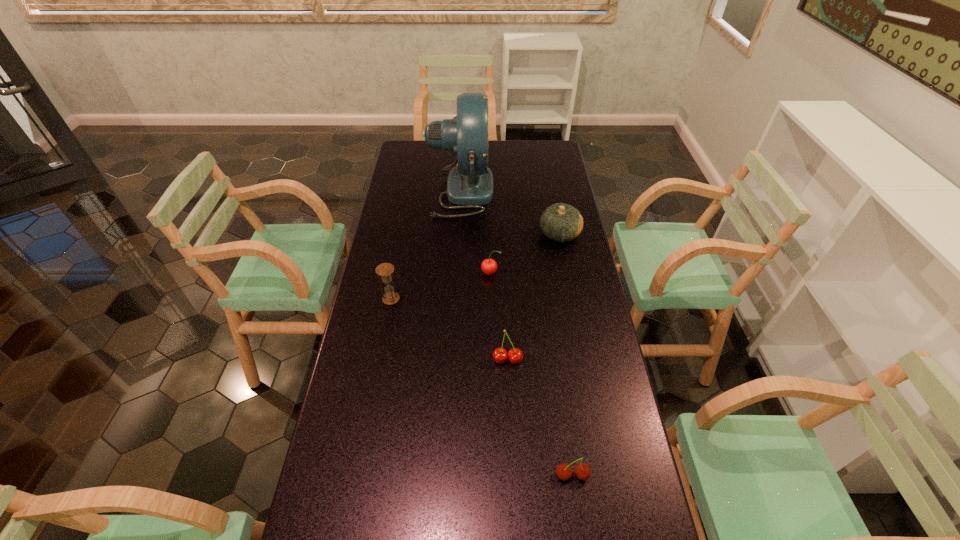
Identify the location of free point between the fan and the gourd. This screenshot has height=540, width=960. (510, 212).

You are a GUI agent. You are given a task and a screenshot of the screen. Output one action in this format:
    pyautogui.click(x=<x>, y=<y>)
    Task: Click on the free spot between the fourth farthest object and the fourth nearest object
    The width and height of the screenshot is (960, 540).
    Given the screenshot: What is the action you would take?
    pyautogui.click(x=441, y=286)

What are the coordinates of `vacant area that lies between the farthest cherry and the fifth farthest object` in the screenshot? It's located at (499, 316).

Where is `unoccupied area between the second nearest cherry and the nearest cherry`? This screenshot has width=960, height=540. unoccupied area between the second nearest cherry and the nearest cherry is located at coordinates (x=540, y=417).

Identify which object is the nearest to the third farthest object. Please provide its 2D coordinates. Your answer should be formatted as a tuple, i.e. [(x, y)], where the tuple contains the x and y coordinates of a point satisfying the conditions above.

[(561, 222)]

Identify which object is located as the nearest to the second farthest cherry. Please provide its 2D coordinates. Your answer should be formatted as a tuple, i.e. [(x, y)], where the tuple contains the x and y coordinates of a point satisfying the conditions above.

[(564, 472)]

Point out which cherry is positioned as the second nearest to the third farthest object. Please provide its 2D coordinates. Your answer should be formatted as a tuple, i.e. [(x, y)], where the tuple contains the x and y coordinates of a point satisfying the conditions above.

[(564, 472)]

Select which cherry is the closest to the farthest cherry. Please provide its 2D coordinates. Your answer should be formatted as a tuple, i.e. [(x, y)], where the tuple contains the x and y coordinates of a point satisfying the conditions above.

[(515, 355)]

You are a GUI agent. You are given a task and a screenshot of the screen. Output one action in this format:
    pyautogui.click(x=<x>, y=<y>)
    Task: Click on the free space that satisfies the following two spatial constraints: 1. in front of the farthest object to blow air; 2. on the front side of the leftmost object
    The height and width of the screenshot is (540, 960).
    Given the screenshot: What is the action you would take?
    pyautogui.click(x=455, y=299)

The height and width of the screenshot is (540, 960). In order to click on free space that satisfies the following two spatial constraints: 1. in front of the fifth nearest object to blow air; 2. on the right side of the tallest object in this screenshot , I will do `click(459, 234)`.